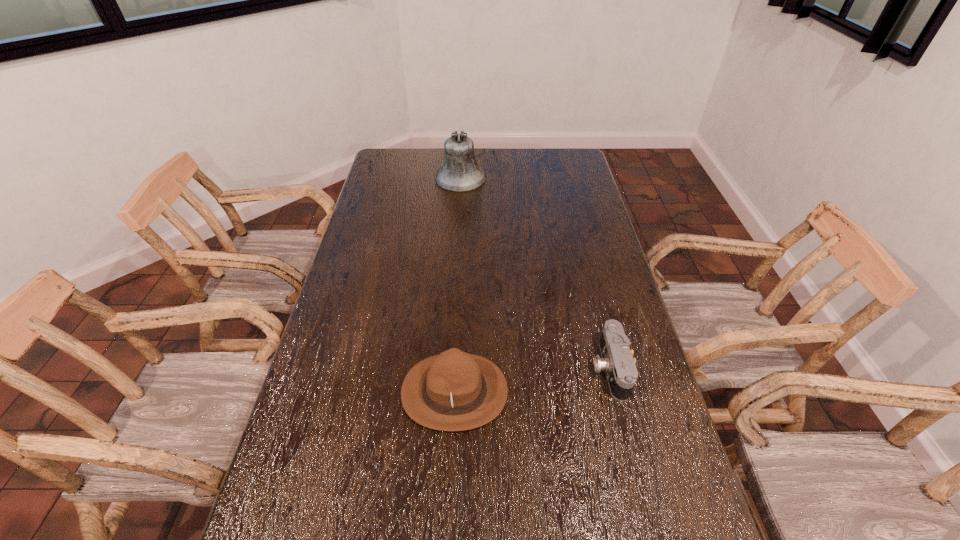
The height and width of the screenshot is (540, 960). In order to click on object that is at the far edge in this screenshot , I will do `click(460, 172)`.

Identify the location of object present at the right edge. Image resolution: width=960 pixels, height=540 pixels. (617, 361).

The image size is (960, 540). Find the location of `free region at the far edge`. free region at the far edge is located at coordinates coord(536,172).

Find the location of a particular element. Image resolution: width=960 pixels, height=540 pixels. vacant space at the left edge of the desktop is located at coordinates (337, 366).

What are the coordinates of `vacant space at the right edge of the desktop` in the screenshot? It's located at (601, 264).

I want to click on vacant space at the far right corner of the desktop, so click(561, 155).

Where is `vacant space that's between the bell and the second tallest object`? The image size is (960, 540). vacant space that's between the bell and the second tallest object is located at coordinates (458, 285).

The image size is (960, 540). I want to click on free point between the rightmost object and the fedora, so click(532, 380).

The height and width of the screenshot is (540, 960). I want to click on empty space that is in between the fedora and the rightmost object, so click(x=532, y=380).

Identify the location of vacant point located between the farthest object and the shortest object. (535, 273).